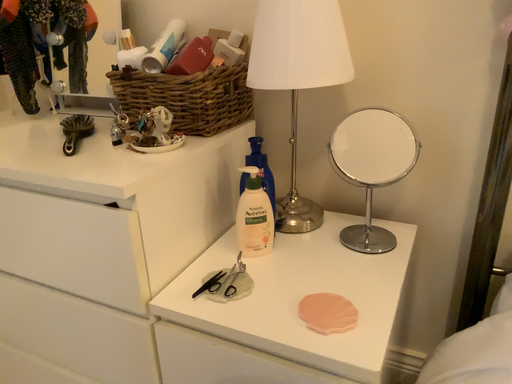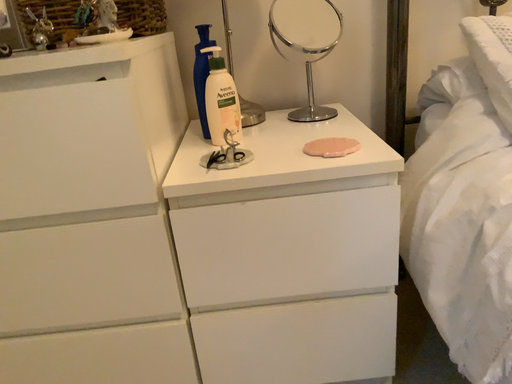
Question: Which way did the camera rotate in the video?

Choices:
 (A) rotated left
 (B) rotated right

Answer: (B)